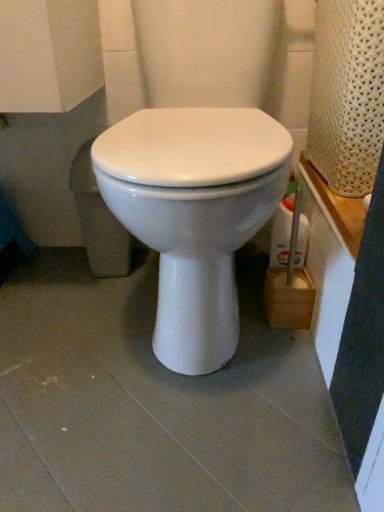
Describe the element at coordinates (155, 404) in the screenshot. I see `white smooth concrete at center` at that location.

Identify the location of white smooth concrete at center. (155, 404).

The width and height of the screenshot is (384, 512). In order to click on white smooth concrete at center in this screenshot , I will do `click(155, 404)`.